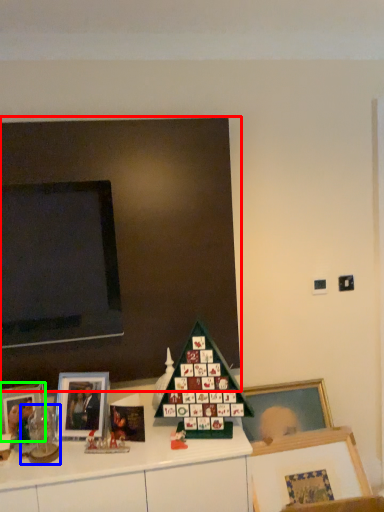
Question: Which is farther away from bulletin board (highlighted by a red box)? toy (highlighted by a blue box) or picture frame (highlighted by a green box)?

Choices:
 (A) toy
 (B) picture frame

Answer: (A)